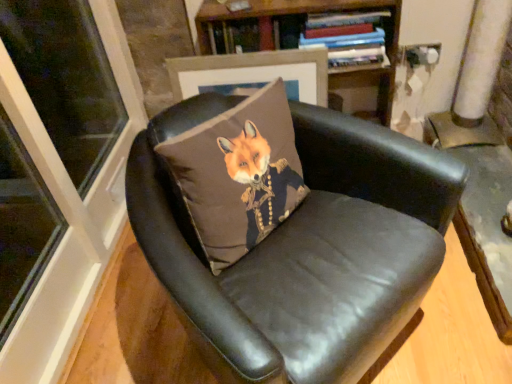
Question: Is matte brown picture frame at upper center wider than hardcover book at upper center?

Choices:
 (A) no
 (B) yes

Answer: (A)

Question: Is matte brown picture frame at upper center behind hardcover book at upper center?

Choices:
 (A) yes
 (B) no

Answer: (A)

Question: Is there a large distance between matte brown picture frame at upper center and hardcover book at upper center?

Choices:
 (A) yes
 (B) no

Answer: (B)

Question: Can you confirm if matte brown picture frame at upper center is positioned to the right of hardcover book at upper center?

Choices:
 (A) yes
 (B) no

Answer: (B)

Question: Can you confirm if matte brown picture frame at upper center is thinner than hardcover book at upper center?

Choices:
 (A) no
 (B) yes

Answer: (B)

Question: Can you confirm if matte brown picture frame at upper center is shorter than hardcover book at upper center?

Choices:
 (A) no
 (B) yes

Answer: (A)

Question: Is black leather chair at center directly adjacent to hardcover book at upper center?

Choices:
 (A) no
 (B) yes

Answer: (A)

Question: Can you confirm if black leather chair at center is thinner than hardcover book at upper center?

Choices:
 (A) yes
 (B) no

Answer: (B)

Question: Is black leather chair at center further to camera compared to hardcover book at upper center?

Choices:
 (A) no
 (B) yes

Answer: (A)

Question: Are black leather chair at center and hardcover book at upper center far apart?

Choices:
 (A) yes
 (B) no

Answer: (B)

Question: Is black leather chair at center looking in the opposite direction of hardcover book at upper center?

Choices:
 (A) no
 (B) yes

Answer: (A)

Question: Considering the relative sizes of black leather chair at center and hardcover book at upper center in the image provided, is black leather chair at center bigger than hardcover book at upper center?

Choices:
 (A) yes
 (B) no

Answer: (A)

Question: Does brown fabric fox at center lie in front of wooden bookshelf at upper center?

Choices:
 (A) no
 (B) yes

Answer: (B)